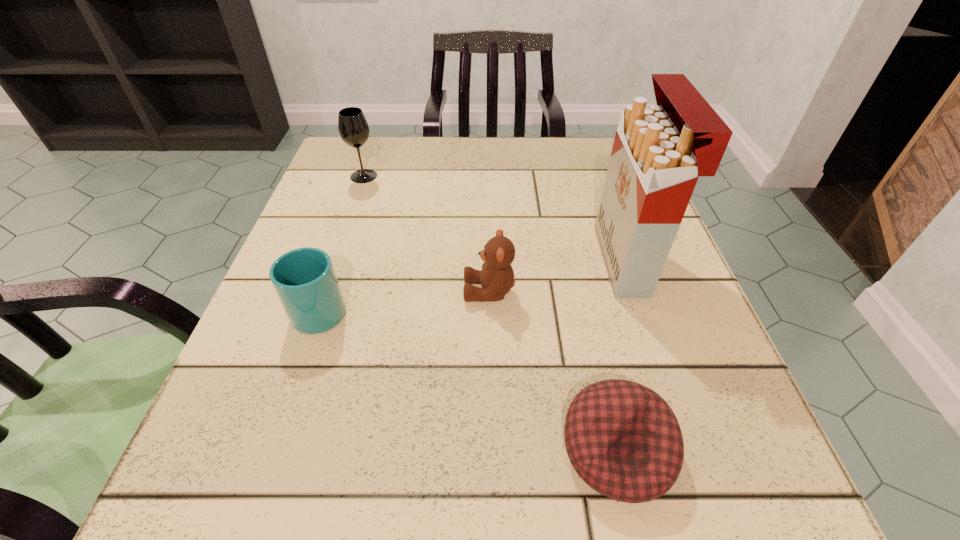
Find the location of a particular element. vacant space that's between the cup and the third object from left to right is located at coordinates (405, 300).

Locate which object ranks second in proximity to the nearest object. Please provide its 2D coordinates. Your answer should be formatted as a tuple, i.e. [(x, y)], where the tuple contains the x and y coordinates of a point satisfying the conditions above.

[(659, 151)]

Where is `the closest object to the cup`? This screenshot has height=540, width=960. the closest object to the cup is located at coordinates (497, 276).

Image resolution: width=960 pixels, height=540 pixels. I want to click on blank area in the image that satisfies the following two spatial constraints: 1. on the face of the teddy bear; 2. on the back side of the beanbag, so click(x=492, y=450).

At what (x,y) coordinates should I click in order to perform the action: click on vacant area that satisfies the following two spatial constraints: 1. on the face of the teddy bear; 2. on the right side of the beanbag. Please return your answer as a coordinate pair (x, y). Looking at the image, I should click on (492, 450).